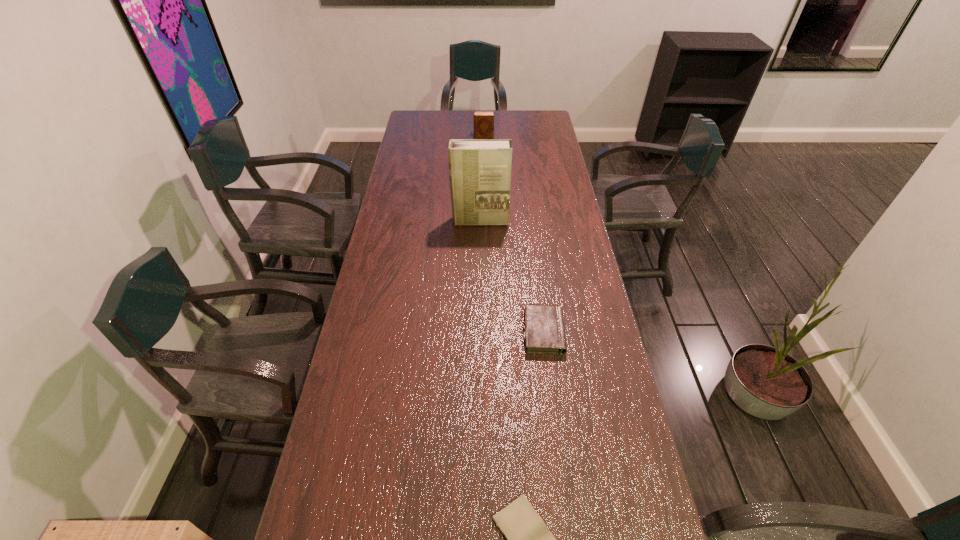
Locate an element on the screen. Image resolution: width=960 pixels, height=540 pixels. the second closest diary to the phonebook is located at coordinates coord(483,120).

I want to click on vacant region that satisfies the following two spatial constraints: 1. on the cover of the phonebook; 2. on the right side of the second nearest object, so click(x=480, y=332).

Find the location of a particular element. free space that satisfies the following two spatial constraints: 1. on the spine side of the farthest object; 2. on the cover of the phonebook is located at coordinates (485, 221).

The image size is (960, 540). Find the location of `vacant area that satisfies the following two spatial constraints: 1. on the spine side of the tallest diary; 2. on the left side of the second farthest diary`. vacant area that satisfies the following two spatial constraints: 1. on the spine side of the tallest diary; 2. on the left side of the second farthest diary is located at coordinates (486, 332).

Where is `free location that satisfies the following two spatial constraints: 1. on the spine side of the farthest object; 2. on the cover of the tallest object`? This screenshot has height=540, width=960. free location that satisfies the following two spatial constraints: 1. on the spine side of the farthest object; 2. on the cover of the tallest object is located at coordinates (485, 221).

Locate an element on the screen. The height and width of the screenshot is (540, 960). free location that satisfies the following two spatial constraints: 1. on the spine side of the tallest diary; 2. on the cover of the phonebook is located at coordinates (485, 221).

At what (x,y) coordinates should I click in order to perform the action: click on vacant region that satisfies the following two spatial constraints: 1. on the cover of the second farthest diary; 2. on the left side of the second farthest object. Please return your answer as a coordinate pair (x, y). The height and width of the screenshot is (540, 960). Looking at the image, I should click on (480, 332).